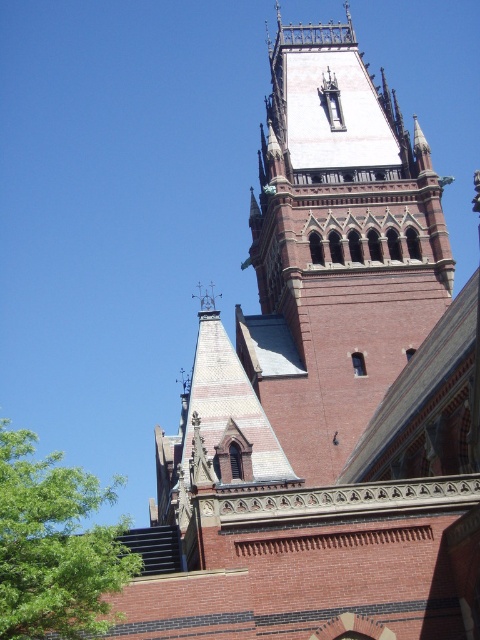
You are standing in front of a historic Gothic Revival building. You notice a specific point marked at coordinates point (326,403). Given that the building is quite large, can you estimate whether this point is within a comfortable viewing distance for the average person?

The point (326,403) is 65.65 meters away from the camera, which is beyond the average comfortable viewing distance of around 20 meters. Therefore, it would be difficult to see details clearly at that distance.

You are standing in front of the grand historic building and want to take a photo that includes both the red brick bell tower at center and the green leafy tree at lower left. Which object should you position closer to the front of your camera frame to ensure both are in focus?

You should position the green leafy tree at lower left closer to the front of your camera frame because the red brick bell tower at center is further away from you, so by placing the nearer object forward, both will be in focus.

You are an architect assessing the building layout. The red brick bell tower at center and the green leafy tree at lower left are both visible from the main entrance. Which structure appears larger in the view?

The green leafy tree at lower left appears larger in the view because the red brick bell tower at center has a smaller size compared to it.